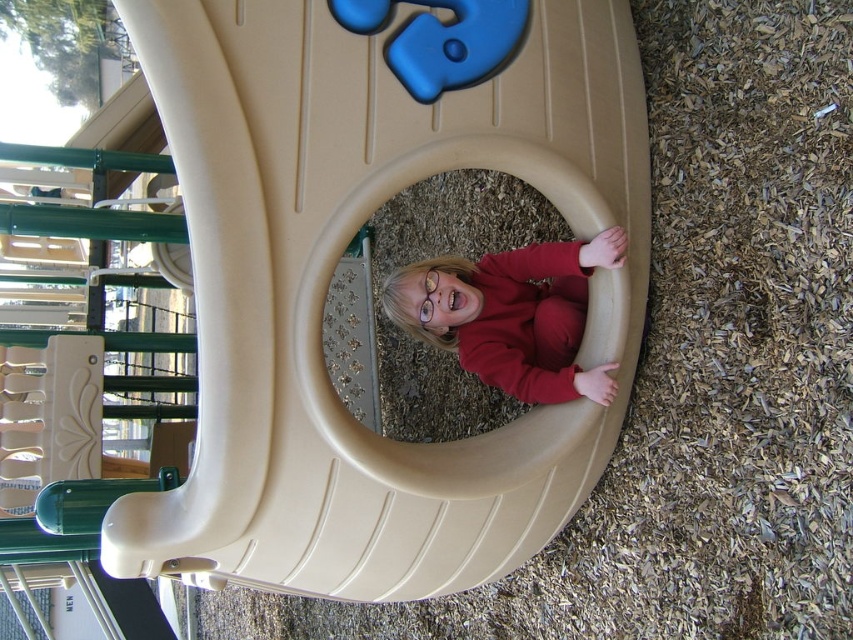
Question: Does tan plastic slide at center have a larger size compared to matte red sweater at center?

Choices:
 (A) no
 (B) yes

Answer: (B)

Question: Does tan plastic slide at center have a smaller size compared to matte red sweater at center?

Choices:
 (A) no
 (B) yes

Answer: (A)

Question: Is tan plastic slide at center in front of matte red sweater at center?

Choices:
 (A) yes
 (B) no

Answer: (A)

Question: Among these objects, which one is nearest to the camera?

Choices:
 (A) tan plastic slide at center
 (B) matte red sweater at center

Answer: (A)

Question: Which object appears closest to the camera in this image?

Choices:
 (A) matte red sweater at center
 (B) tan plastic slide at center

Answer: (B)

Question: Which object is farther from the camera taking this photo?

Choices:
 (A) tan plastic slide at center
 (B) matte red sweater at center

Answer: (B)